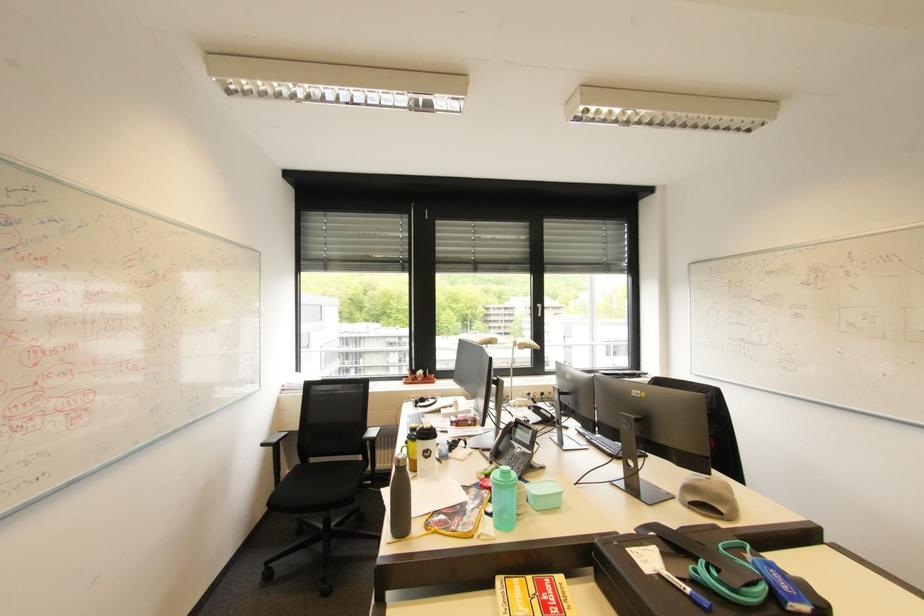
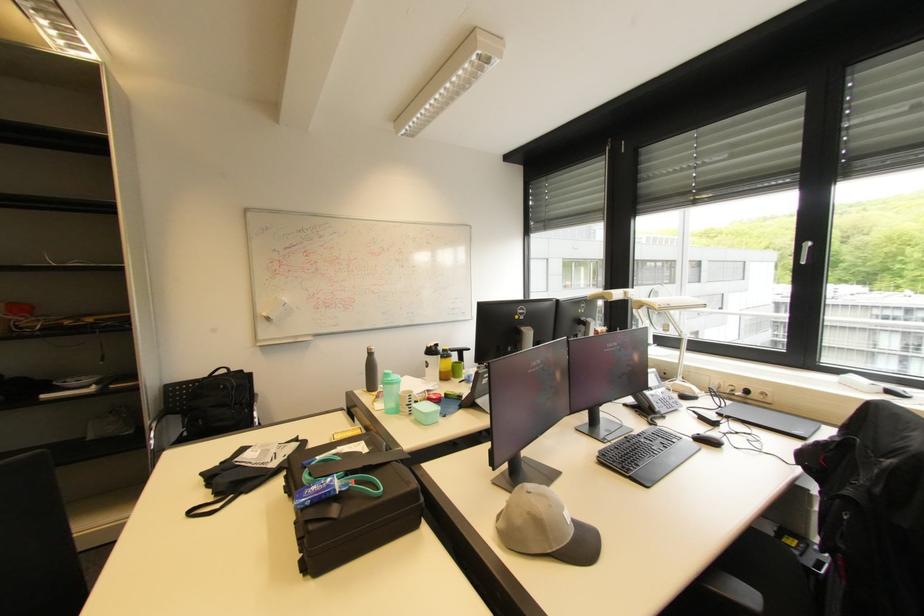
Find the pixel in the second image that matches (517,477) in the first image.

(394, 379)